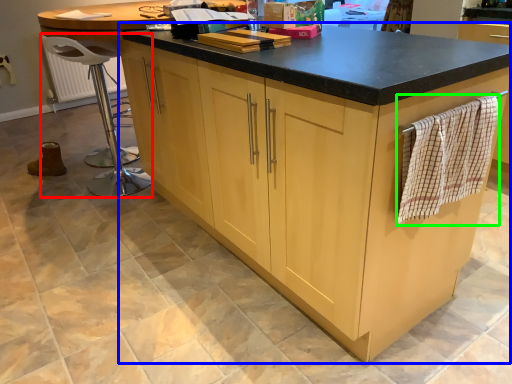
Question: Which is nearer to the bar stool (highlighted by a red box)? cabinetry (highlighted by a blue box) or blanket (highlighted by a green box).

Choices:
 (A) cabinetry
 (B) blanket

Answer: (A)